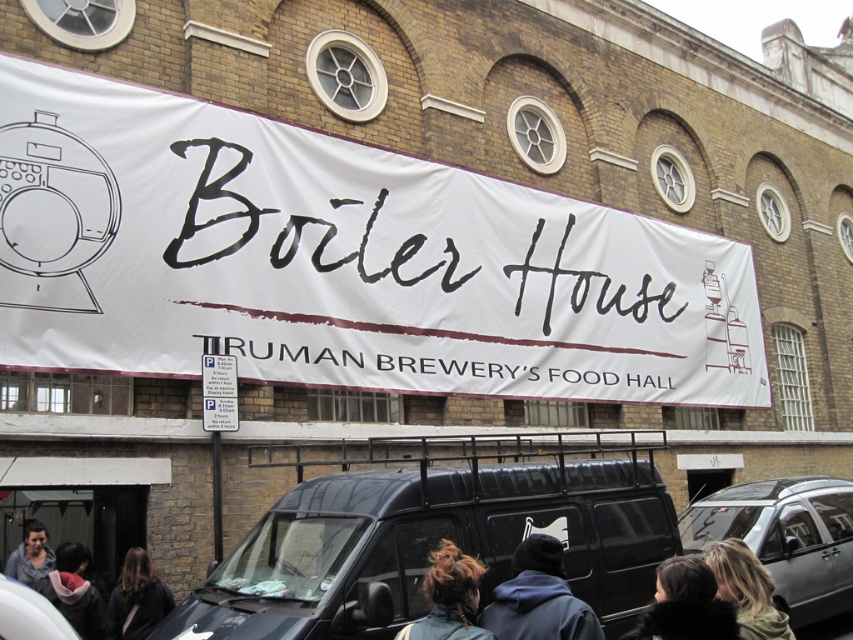
Is white paper banner at center taller than silver metallic car at lower right?

Correct, white paper banner at center is much taller as silver metallic car at lower right.

Describe the element at coordinates (340, 260) in the screenshot. I see `white paper banner at center` at that location.

Identify the location of white paper banner at center. This screenshot has width=853, height=640. (340, 260).

In the scene shown: Between black fur coat at lower center and black matte van at lower left, which one has more height?

black fur coat at lower center is taller.

Which is above, black fur coat at lower center or black matte van at lower left?

black matte van at lower left is above.

Between point (717, 637) and point (39, 632), which one is positioned in front?

Point (39, 632) is in front.

Where is `black fur coat at lower center`? The width and height of the screenshot is (853, 640). black fur coat at lower center is located at coordinates (685, 604).

Which is in front, point (607, 552) or point (54, 552)?

Point (607, 552) is in front.

This screenshot has height=640, width=853. What are the coordinates of `black matte van at center` in the screenshot? It's located at coord(430,547).